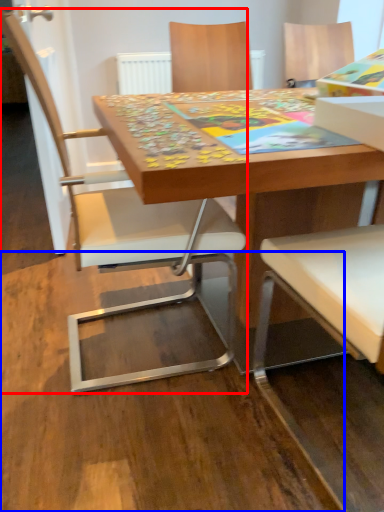
Question: Among these objects, which one is nearest to the camera, chair (highlighted by a red box) or plywood (highlighted by a blue box)?

Choices:
 (A) chair
 (B) plywood

Answer: (B)